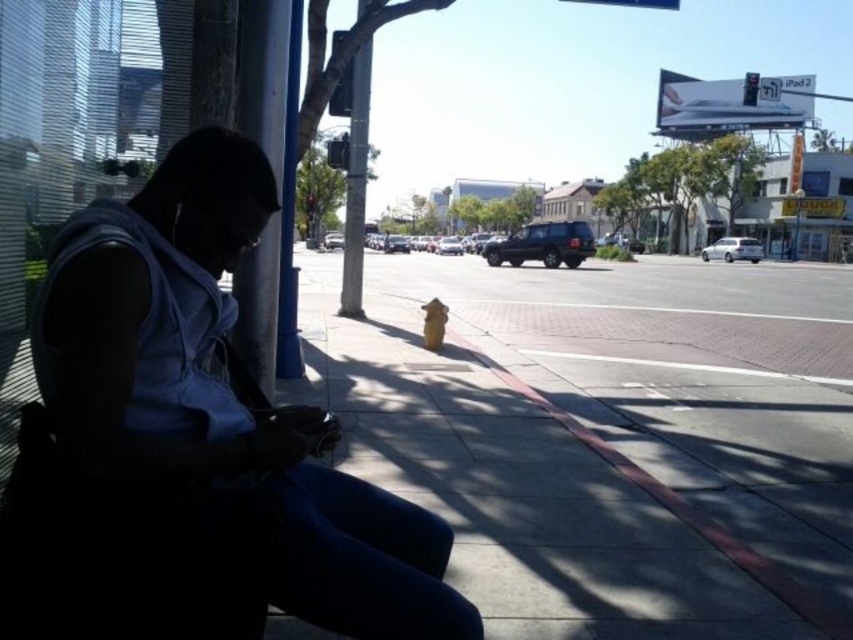
The width and height of the screenshot is (853, 640). I want to click on matte gray hoodie at left, so click(x=223, y=401).

This screenshot has width=853, height=640. What do you see at coordinates (223, 401) in the screenshot?
I see `matte gray hoodie at left` at bounding box center [223, 401].

Measure the distance between point [228,376] and camera.

Point [228,376] and camera are 1.29 meters apart from each other.

At what (x,y) coordinates should I click in order to perform the action: click on matte gray hoodie at left. Please return your answer as a coordinate pair (x, y). Looking at the image, I should click on (223, 401).

Locate an element on the screen. yellow fire hydrant at center is located at coordinates (607, 436).

Measure the distance between yellow fire hydrant at center and camera.

yellow fire hydrant at center and camera are 1.61 meters apart.

Locate an element on the screen. yellow fire hydrant at center is located at coordinates (607, 436).

Between point (149, 362) and point (366, 68), which one is positioned behind?

The point (366, 68) is more distant.

Where is `matte gray hoodie at left`? The image size is (853, 640). matte gray hoodie at left is located at coordinates click(x=223, y=401).